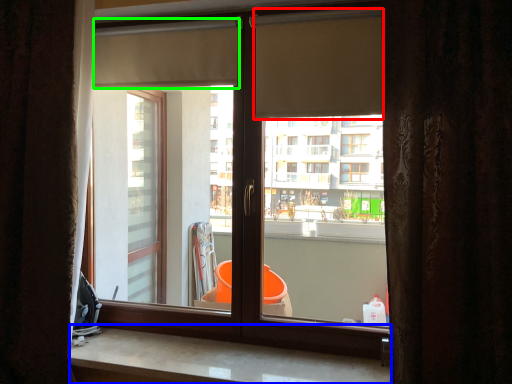
Question: Which object is the closest to the shutter (highlighted by a red box)? Choose among these: counter top (highlighted by a blue box) or shutter (highlighted by a green box).

Choices:
 (A) counter top
 (B) shutter

Answer: (B)